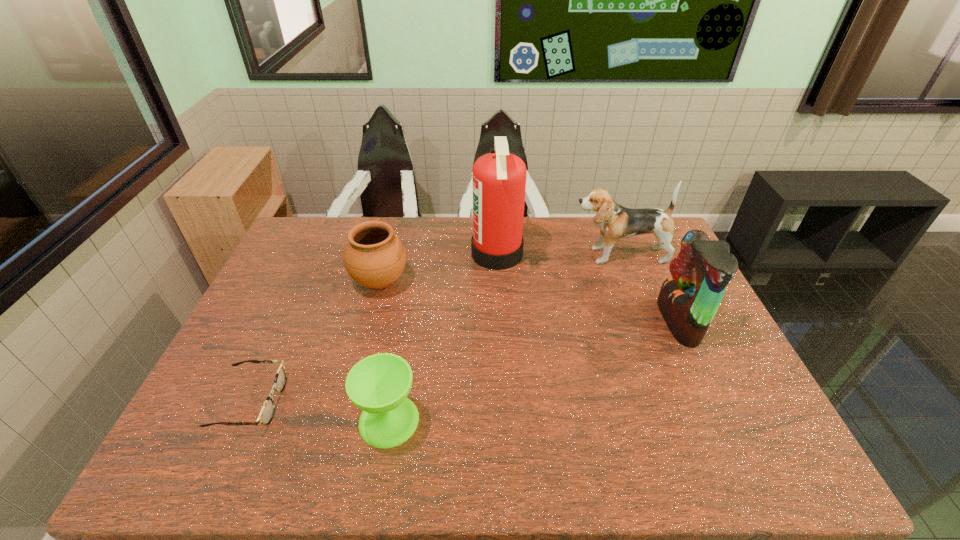
Identify the location of vacant space at the far left corner of the desktop. (306, 247).

Locate an element on the screen. The width and height of the screenshot is (960, 540). blank region between the wineglass and the puppy is located at coordinates (504, 338).

Locate an element on the screen. The image size is (960, 540). vacant space that's between the puppy and the leftmost object is located at coordinates (435, 329).

Image resolution: width=960 pixels, height=540 pixels. Identify the location of vacant region between the fifth tallest object and the third object from right to left. click(x=443, y=337).

Where is `free spot between the tallest object and the parrot`? free spot between the tallest object and the parrot is located at coordinates [588, 288].

Identify the location of free space between the third shortest object and the parrot. The image size is (960, 540). (529, 302).

This screenshot has width=960, height=540. Find the location of `vacant region between the fourth tallest object and the fourth object from left to right`. vacant region between the fourth tallest object and the fourth object from left to right is located at coordinates (439, 268).

Find the location of `free area in between the pottery and the shortest object`. free area in between the pottery and the shortest object is located at coordinates (315, 342).

Locate an element on the screen. empty location between the shortest object and the parrot is located at coordinates [x=465, y=362].

I want to click on vacant space in between the puppy and the parrot, so click(x=649, y=288).